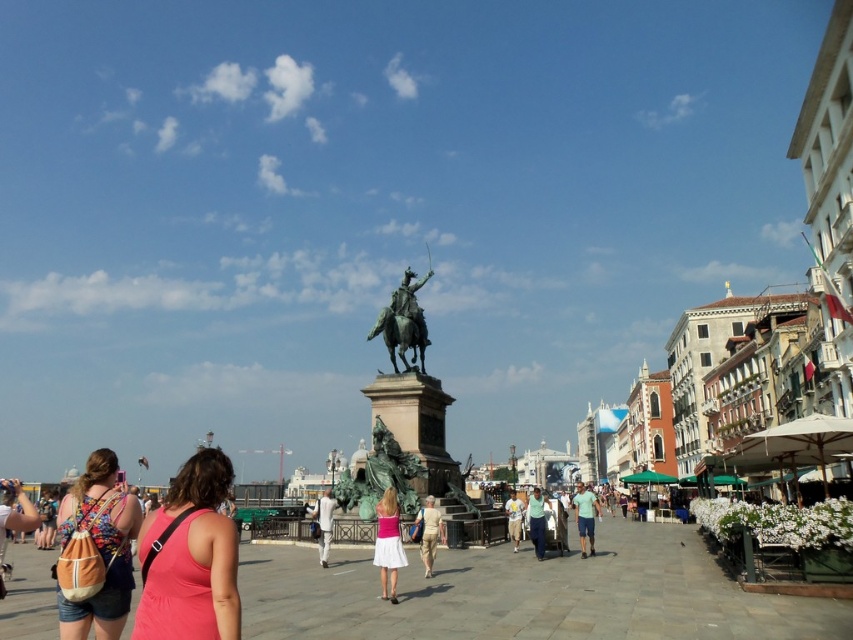
Between point (213, 452) and point (379, 547), which one is positioned behind?

The point (379, 547) is behind.

Which is more to the right, pink fabric dress at lower left or pink satin dress at center?

pink satin dress at center is more to the right.

Describe the element at coordinates (190, 557) in the screenshot. I see `pink fabric dress at lower left` at that location.

Image resolution: width=853 pixels, height=640 pixels. What are the coordinates of `pink fabric dress at lower left` in the screenshot? It's located at (190, 557).

Is green patina statue at center wider than green fabric shirt at center?

No.

Which is in front, point (418, 467) or point (581, 509)?

Point (581, 509) is more forward.

You are a GUI agent. You are given a task and a screenshot of the screen. Output one action in this format:
    pyautogui.click(x=<x>, y=<y>)
    Task: Click on the green patina statue at center
    The height and width of the screenshot is (640, 853).
    Given the screenshot: What is the action you would take?
    pyautogui.click(x=404, y=417)

Does point (601, 509) come farther from viewer compared to point (540, 509)?

Yes, it is.

Between green fabric shirt at center and green fabric dress at center, which one appears on the left side from the viewer's perspective?

Positioned to the left is green fabric dress at center.

Is point (590, 497) positioned after point (527, 513)?

No, (590, 497) is closer to viewer.

Locate an element on the screen. green fabric shirt at center is located at coordinates (585, 516).